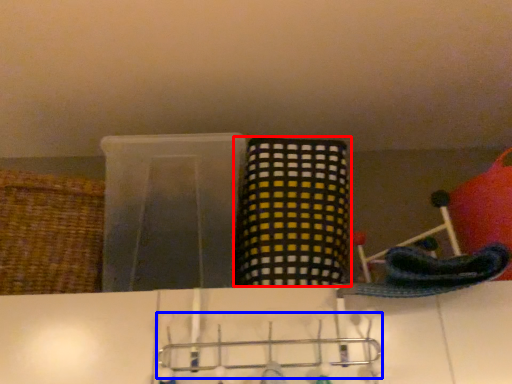
Question: Which object is closer to the camera taking this photo, basket (highlighted by a red box) or hanger (highlighted by a blue box)?

Choices:
 (A) basket
 (B) hanger

Answer: (B)